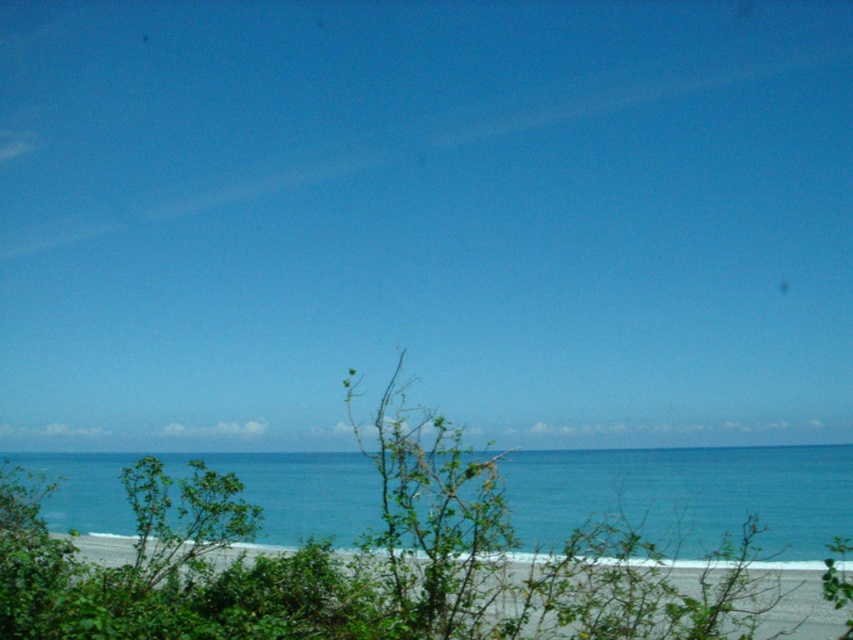
From the picture: Does green leafy shrub at center appear on the left side of blue water at center?

Yes, green leafy shrub at center is to the left of blue water at center.

Is green leafy shrub at center shorter than blue water at center?

Indeed, green leafy shrub at center has a lesser height compared to blue water at center.

Which is behind, point (166, 516) or point (540, 509)?

The point (540, 509) is behind.

I want to click on green leafy shrub at center, so click(358, 563).